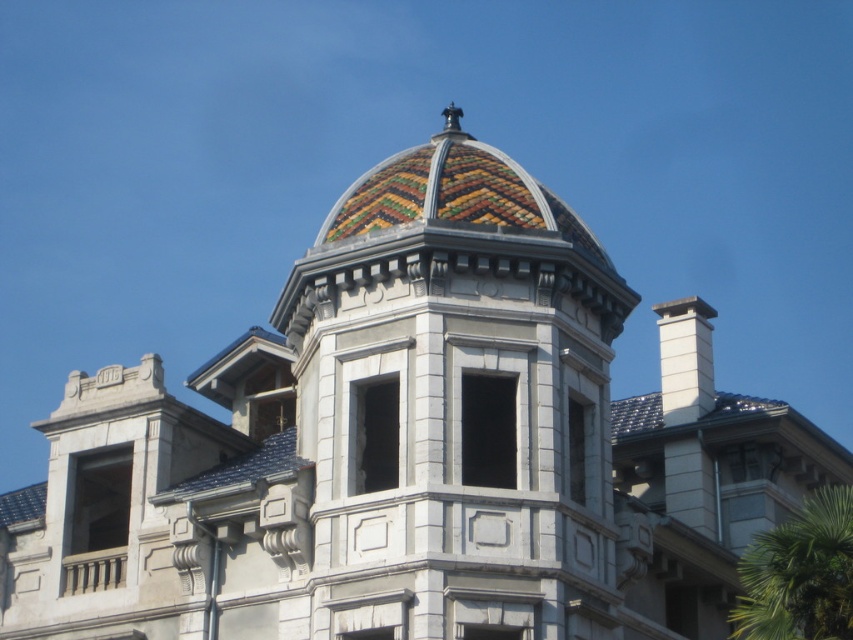
Based on the photo, can you confirm if mosaic tile dome at center is positioned above green leafy palm tree at lower right?

Yes, mosaic tile dome at center is above green leafy palm tree at lower right.

Is mosaic tile dome at center to the left of green leafy palm tree at lower right from the viewer's perspective?

Correct, you'll find mosaic tile dome at center to the left of green leafy palm tree at lower right.

Who is more distant from viewer, (x=523, y=244) or (x=735, y=628)?

The point (x=735, y=628) is more distant.

Where is `mosaic tile dome at center`? The image size is (853, 640). mosaic tile dome at center is located at coordinates (451, 234).

Is multicolored mosaic dome at center taller than green leafy palm tree at lower right?

Indeed, multicolored mosaic dome at center has a greater height compared to green leafy palm tree at lower right.

Based on the photo, does multicolored mosaic dome at center lie in front of green leafy palm tree at lower right?

No, multicolored mosaic dome at center is behind green leafy palm tree at lower right.

This screenshot has height=640, width=853. Describe the element at coordinates (456, 403) in the screenshot. I see `multicolored mosaic dome at center` at that location.

You are a GUI agent. You are given a task and a screenshot of the screen. Output one action in this format:
    pyautogui.click(x=<x>, y=<y>)
    Task: Click on the multicolored mosaic dome at center
    
    Given the screenshot: What is the action you would take?
    (x=456, y=403)

Identify the location of multicolored mosaic dome at center. (456, 403).

Can you confirm if multicolored mosaic dome at center is positioned above mosaic tile dome at center?

Actually, multicolored mosaic dome at center is below mosaic tile dome at center.

Find the location of a particular element. This screenshot has height=640, width=853. multicolored mosaic dome at center is located at coordinates (456, 403).